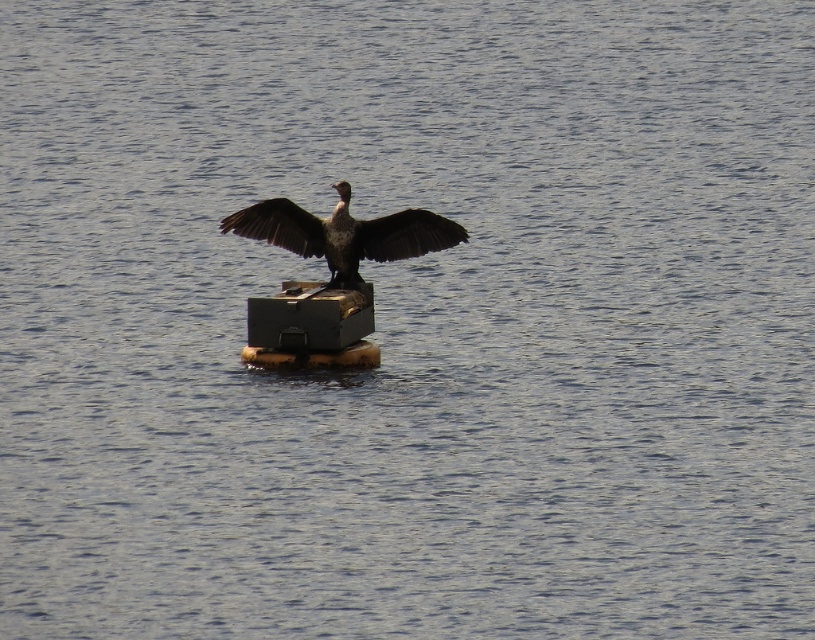
Question: Can you confirm if dark brown feathers at center is positioned to the right of dark brown feathered wing at center?

Choices:
 (A) yes
 (B) no

Answer: (A)

Question: Does dark brown feathers at center lie in front of dark brown feathered wing at center?

Choices:
 (A) no
 (B) yes

Answer: (B)

Question: Does dark brown feathers at center have a larger size compared to dark brown feathered wing at center?

Choices:
 (A) yes
 (B) no

Answer: (A)

Question: Which point is closer to the camera taking this photo?

Choices:
 (A) (298, 237)
 (B) (430, 220)

Answer: (B)